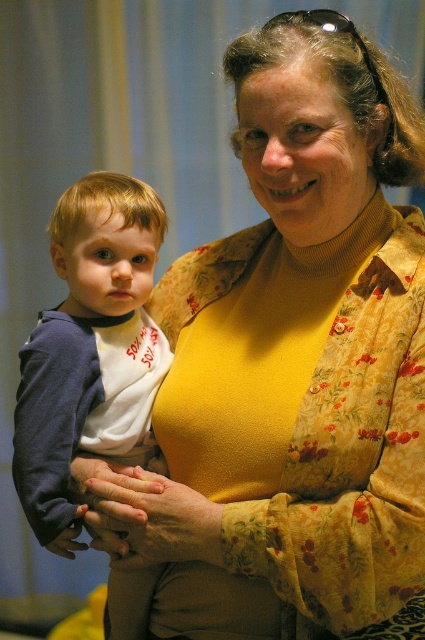
You are standing in the living room and want to reach both the point at coordinates (107, 301) and the point at (340, 22). Which point will you reach first as you move forward?

You will reach the point at coordinates (107, 301) first because it is closer to you than the point at (340, 22), which is further away.

You are a photographer standing 1.5 meters away from the camera. You want to take a photo of the matte blue sweater at left without moving the camera. Is the sweater within your reach to adjust its position?

The matte blue sweater at left is 1.08 meters away from the camera. Since you are standing 1.5 meters away from the camera, the sweater is closer to the camera than your position, so it is within your reach to adjust its position.

You are a tailor who needs to determine which item requires more fabric for a custom order between the matte blue sweater at left and the black plastic sunglasses at upper center. Based on their sizes, which one would need more fabric?

The matte blue sweater at left requires more fabric since its width is greater than the black plastic sunglasses at upper center.